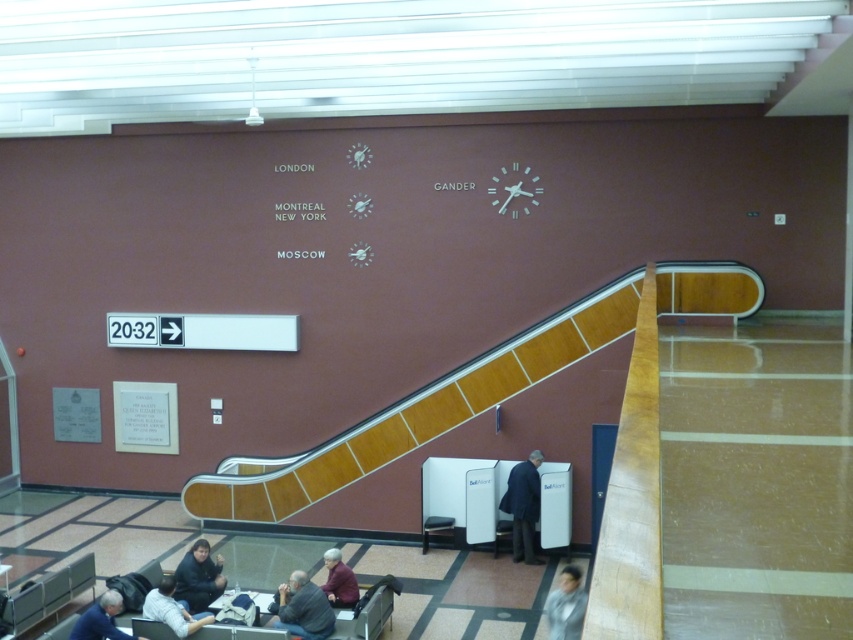
You are standing in the airport terminal and want to walk towards the point labeled as point [297,611]. If you first pass point [563,568], will you be moving away from your destination?

Yes, because point [297,611] is in front of point [563,568], so passing point [563,568] means you are moving away from your destination.

You are standing in the airport terminal and see the gray fabric jacket at lower right and the dark gray sweater at lower left. Which one is positioned more to the right side of the scene?

The gray fabric jacket at lower right is positioned more to the right side of the scene than the dark gray sweater at lower left.